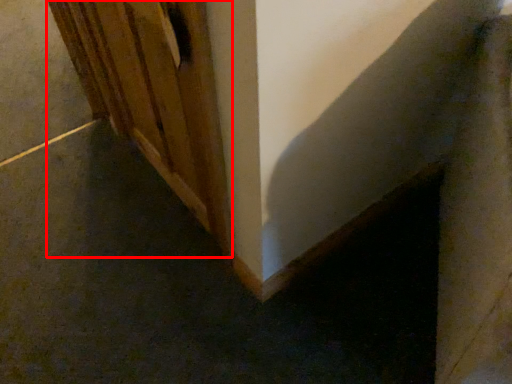
Question: From the image's perspective, where is door (annotated by the red box) located relative to concrete?

Choices:
 (A) above
 (B) below

Answer: (B)